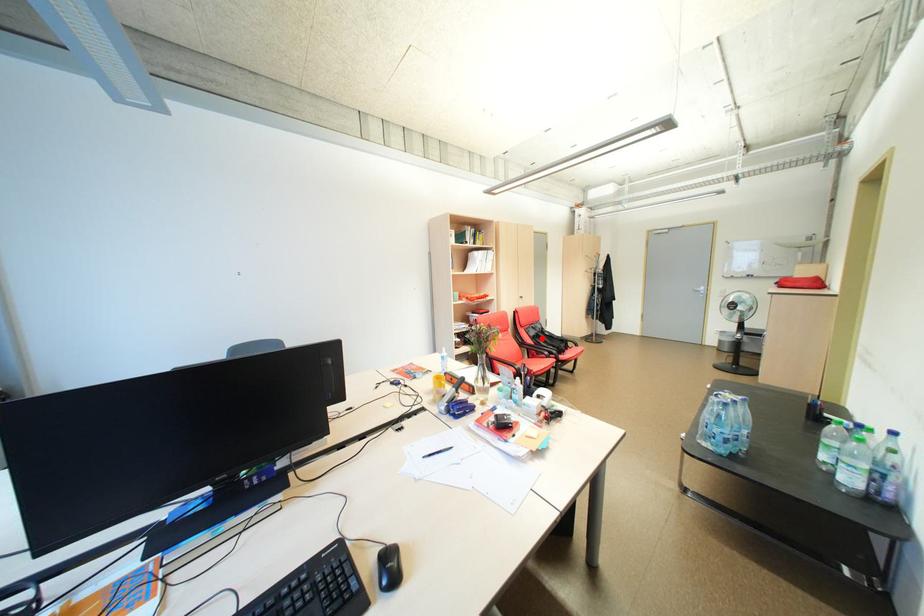
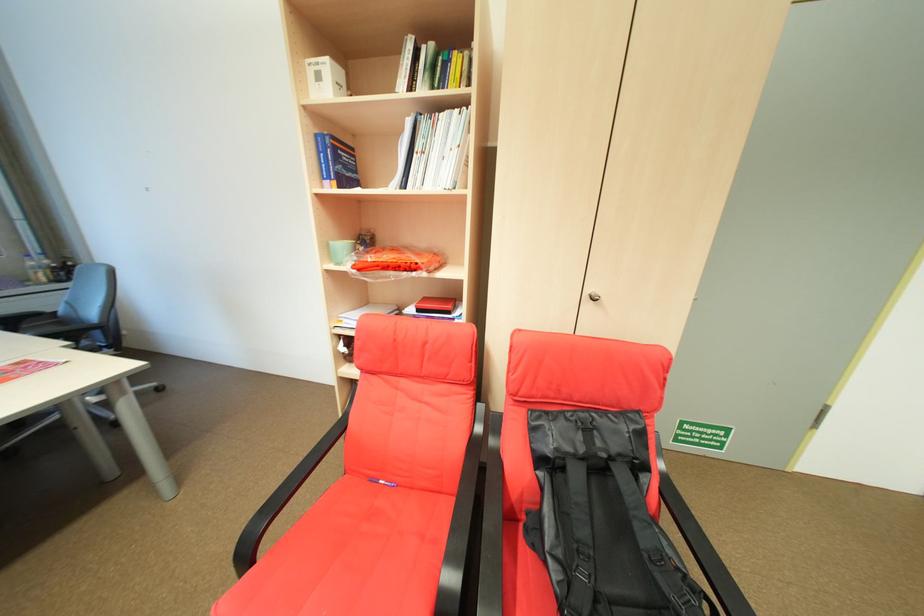
Find the pixel in the second image that matches the highlighted location in the first image.

(549, 461)